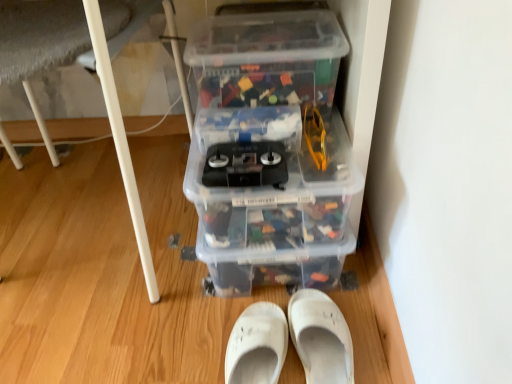
Question: Considering the positions of point (120, 117) and point (309, 253), is point (120, 117) closer or farther from the camera than point (309, 253)?

Choices:
 (A) closer
 (B) farther

Answer: (A)

Question: Looking at their shapes, would you say white plastic table leg at lower left is wider or thinner than transparent plastic storage box at center, placed as the 2th storage box when sorted from top to bottom?

Choices:
 (A) wide
 (B) thin

Answer: (A)

Question: Estimate the real-world distances between objects in this image. Which object is farther from the transparent plastic storage box at center, placed as the 2th storage box when sorted from top to bottom?

Choices:
 (A) transparent plastic storage box at upper center, positioned as the first storage box in top-to-bottom order
 (B) white fabric slipper at lower center, the first footwear in the right-to-left sequence
 (C) white matte shoe at lower center, positioned as the second footwear in right-to-left order
 (D) white plastic table leg at lower left

Answer: (C)

Question: Which of these objects is positioned farthest from the white fabric slipper at lower center, positioned as the 2th footwear in left-to-right order?

Choices:
 (A) white matte shoe at lower center, positioned as the second footwear in right-to-left order
 (B) white plastic table leg at lower left
 (C) transparent plastic storage box at upper center, positioned as the first storage box in top-to-bottom order
 (D) transparent plastic storage box at center, positioned as the first storage box in bottom-to-top order

Answer: (C)